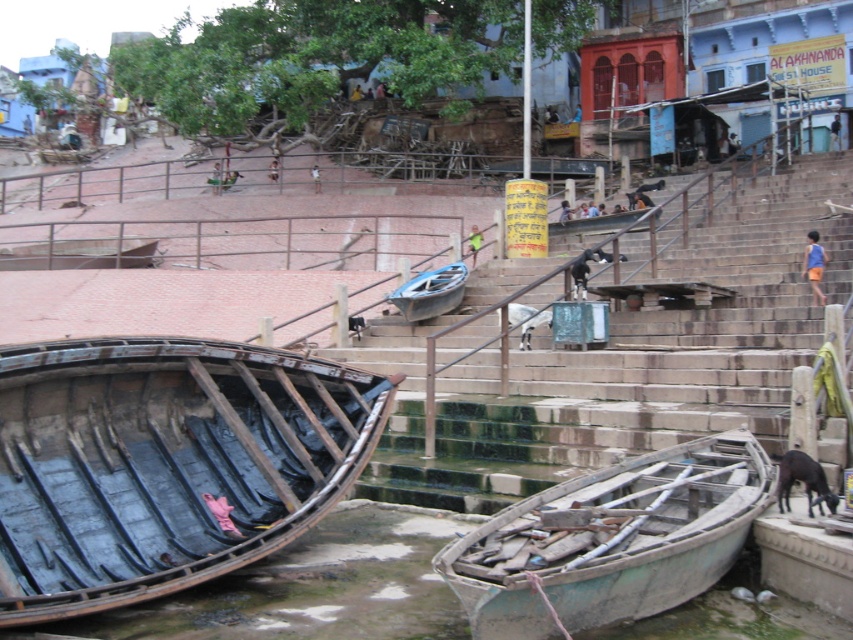
This screenshot has width=853, height=640. Describe the element at coordinates (165, 464) in the screenshot. I see `rusty wood boat at lower left` at that location.

Who is more forward, (378, 406) or (535, 506)?

Positioned in front is point (535, 506).

Between point (102, 371) and point (492, 556), which one is positioned behind?

Point (102, 371)

Find the location of a particular element. The image size is (853, 640). rusty wood boat at lower left is located at coordinates (165, 464).

Who is positioned more to the left, rusty wood boat at lower left or smooth stone stairs at center?

From the viewer's perspective, rusty wood boat at lower left appears more on the left side.

Does rusty wood boat at lower left appear on the left side of smooth stone stairs at center?

Correct, you'll find rusty wood boat at lower left to the left of smooth stone stairs at center.

Is point (12, 388) positioned before point (798, 259)?

Yes, point (12, 388) is closer to viewer.

Where is `rusty wood boat at lower left`? rusty wood boat at lower left is located at coordinates (165, 464).

Between point (51, 458) and point (459, 273), which one is positioned in front?

Point (51, 458) is in front.

Can you confirm if rusty wood boat at lower left is positioned above blue wooden boat at center?

No, rusty wood boat at lower left is not above blue wooden boat at center.

Identify the location of rusty wood boat at lower left. The image size is (853, 640). (165, 464).

This screenshot has height=640, width=853. Find the location of `rusty wood boat at lower left`. rusty wood boat at lower left is located at coordinates (165, 464).